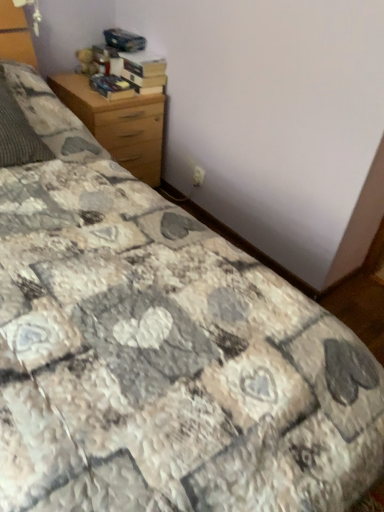
Describe the element at coordinates (118, 124) in the screenshot. I see `wooden chest of drawers at upper left` at that location.

You are a GUI agent. You are given a task and a screenshot of the screen. Output one action in this format:
    pyautogui.click(x=<x>, y=<y>)
    Task: Click on the wooden chest of drawers at upper left
    
    Given the screenshot: What is the action you would take?
    pyautogui.click(x=118, y=124)

In order to click on wooden chest of drawers at upper left in this screenshot , I will do `click(118, 124)`.